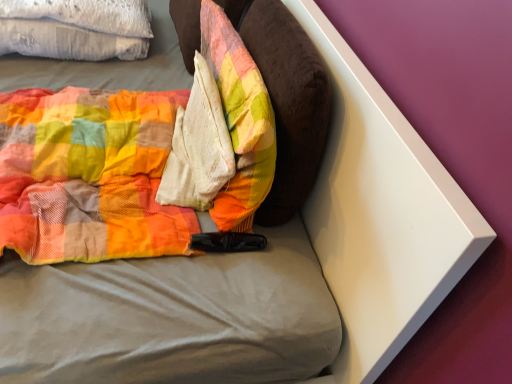
Question: From the image's perspective, is velvety brown pillow at center, the 2th pillow in the left-to-right sequence, located above or below white textured pillow at center?

Choices:
 (A) below
 (B) above

Answer: (B)

Question: Looking at their shapes, would you say velvety brown pillow at center, marked as the 1th pillow in a right-to-left arrangement, is wider or thinner than white textured pillow at center?

Choices:
 (A) wide
 (B) thin

Answer: (B)

Question: Which of these objects is positioned farthest from the white textured pillow at center?

Choices:
 (A) plush fabric pillow at center, placed as the 2th pillow when sorted from right to left
 (B) white textured pillow at upper left
 (C) velvety brown pillow at center, the 2th pillow in the left-to-right sequence

Answer: (B)

Question: Estimate the real-world distances between objects in this image. Which object is closer to the white textured pillow at center?

Choices:
 (A) white textured pillow at upper left
 (B) plush fabric pillow at center, which is counted as the first pillow, starting from the left
 (C) velvety brown pillow at center, marked as the 1th pillow in a right-to-left arrangement

Answer: (B)